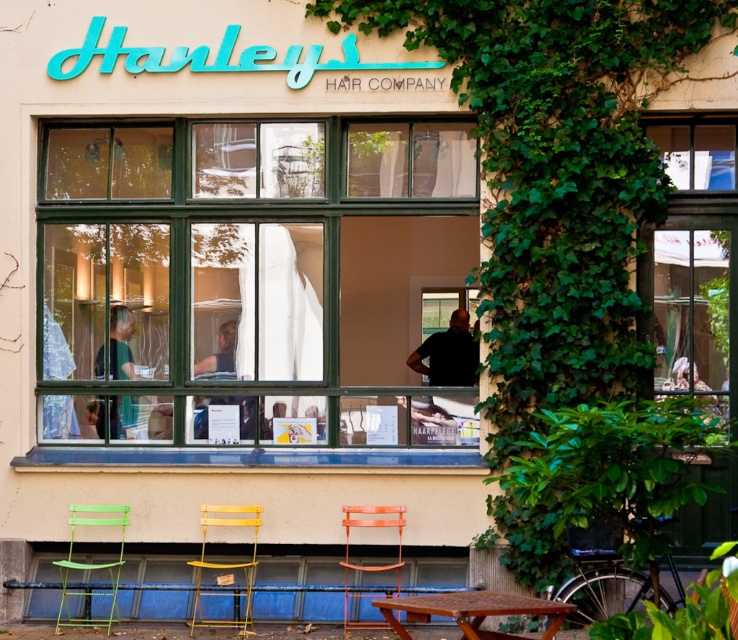
You are a customer waiting to enter Hanley Hair Company. You see a rustic wooden table at lower center and an orange plastic chair at center. Which object is bigger?

The rustic wooden table at lower center is larger in size compared to the orange plastic chair at center.

You are a customer waiting outside Hanley Hair Company and want to choose between the green fabric shirt at left and the black matte shirt at center to pick up. Which shirt is easier to reach without moving from your current position?

The green fabric shirt at left is closer to the viewer, so it is easier to reach without moving from your current position.

You are a customer waiting outside Hanley Hair Company. You see the green wooden window at center and the orange plastic chair at center. Which object is higher in position?

The green wooden window at center is above the orange plastic chair at center, so it is higher in position.